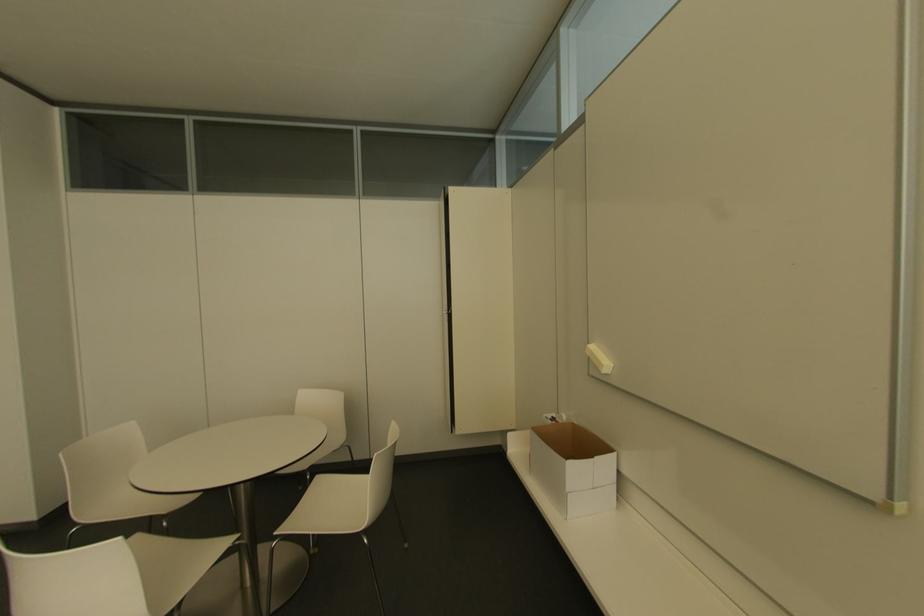
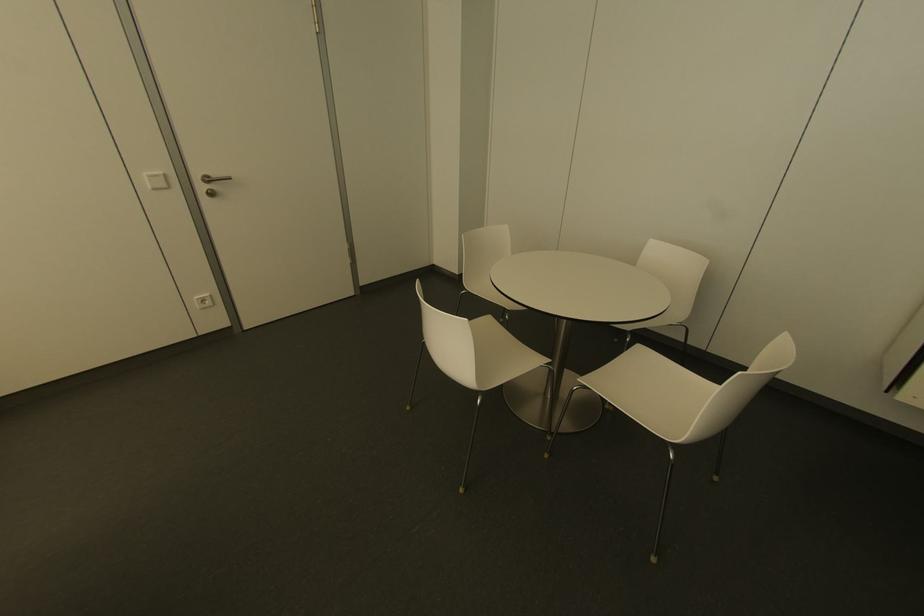
In the second image, find the point that corresponds to [237,536] in the first image.

(546, 361)